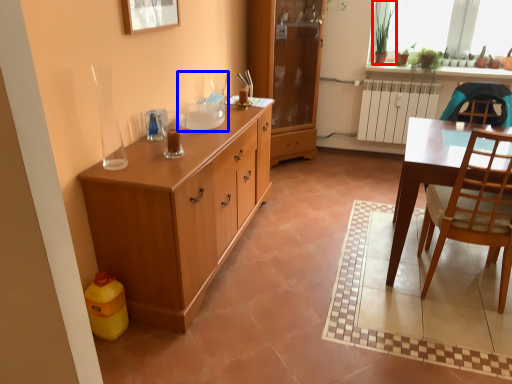
Question: Which object is closer to the camera taking this photo, houseplant (highlighted by a red box) or sink (highlighted by a blue box)?

Choices:
 (A) houseplant
 (B) sink

Answer: (B)